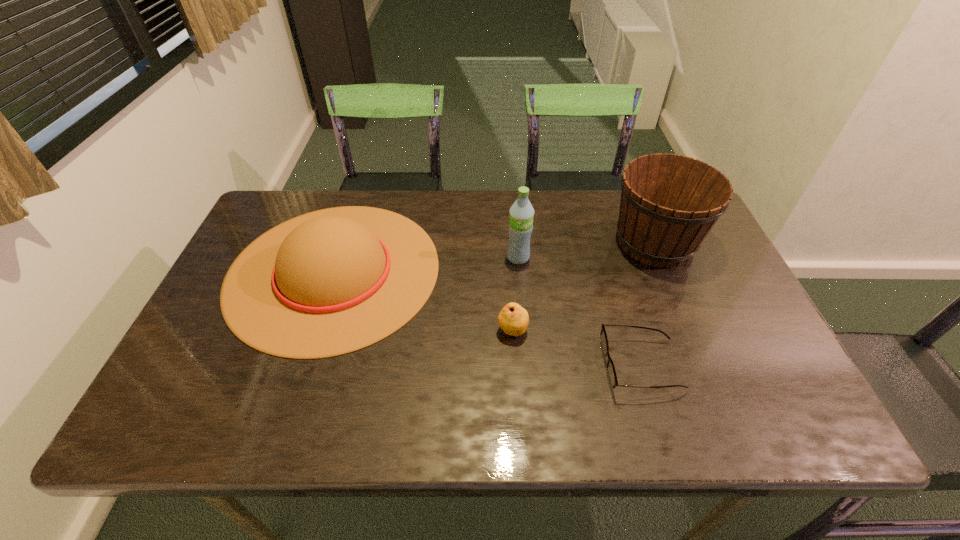
Where is `free point at the far edge`? free point at the far edge is located at coordinates (484, 207).

Identify the location of free space at the near edge. This screenshot has width=960, height=540. (604, 412).

The width and height of the screenshot is (960, 540). What are the coordinates of `vacant space at the left edge` in the screenshot? It's located at (210, 359).

Locate an element on the screen. Image resolution: width=960 pixels, height=540 pixels. vacant area at the far left corner of the desktop is located at coordinates (259, 235).

The width and height of the screenshot is (960, 540). What are the coordinates of `vacant space that is in between the wine bucket and the water bottle` in the screenshot? It's located at (587, 249).

You are a GUI agent. You are given a task and a screenshot of the screen. Output one action in this format:
    pyautogui.click(x=<x>, y=<y>)
    Task: Click on the vacant space that's between the spectacles and the pear
    
    Given the screenshot: What is the action you would take?
    pyautogui.click(x=577, y=348)

Find the location of a particular element. This screenshot has height=540, width=960. unoccupied position between the wine bucket and the shortest object is located at coordinates (648, 304).

Find the location of a particular element. The width and height of the screenshot is (960, 540). vacant area between the wine bucket and the shortest object is located at coordinates (648, 304).

What are the coordinates of `vacant space that is in between the second shortest object and the shortest object` in the screenshot? It's located at (577, 348).

The image size is (960, 540). I want to click on free point between the wine bucket and the water bottle, so click(587, 249).